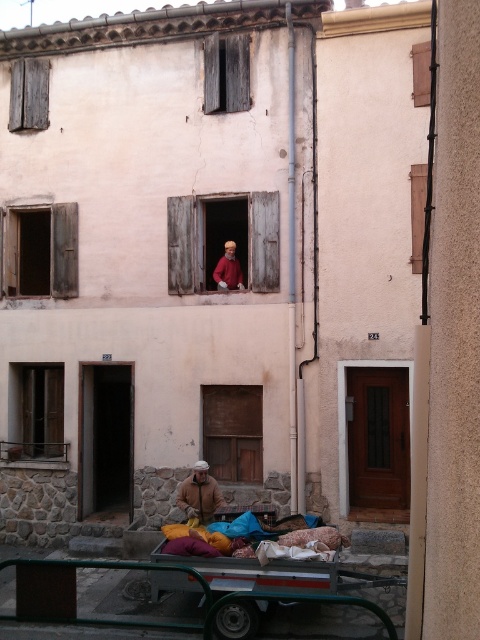
Question: Based on their relative distances, which object is nearer to the wooden shutters at upper center?

Choices:
 (A) wooden shutters at left
 (B) green metal wagon at lower center
 (C) wooden at right

Answer: (C)

Question: Among these objects, which one is nearest to the camera?

Choices:
 (A) brown wooden window at center
 (B) wooden at center
 (C) wooden window at lower left

Answer: (B)

Question: From the image, what is the correct spatial relationship of dark wood window at upper center in relation to wooden shutters at upper center?

Choices:
 (A) above
 (B) below

Answer: (A)

Question: Which is nearer to the wooden at center?

Choices:
 (A) wooden at right
 (B) dark wood window at upper center
 (C) brown wooden window at center

Answer: (B)

Question: Is wooden shutter at upper left wider than brown fuzzy jacket at lower center?

Choices:
 (A) yes
 (B) no

Answer: (A)

Question: Is green metal wagon at lower center below wooden shutters at left?

Choices:
 (A) yes
 (B) no

Answer: (A)